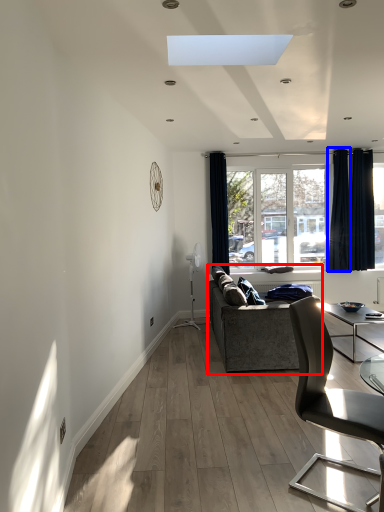
Question: Which object is closer to the camera taking this photo, studio couch (highlighted by a red box) or curtain (highlighted by a blue box)?

Choices:
 (A) studio couch
 (B) curtain

Answer: (A)